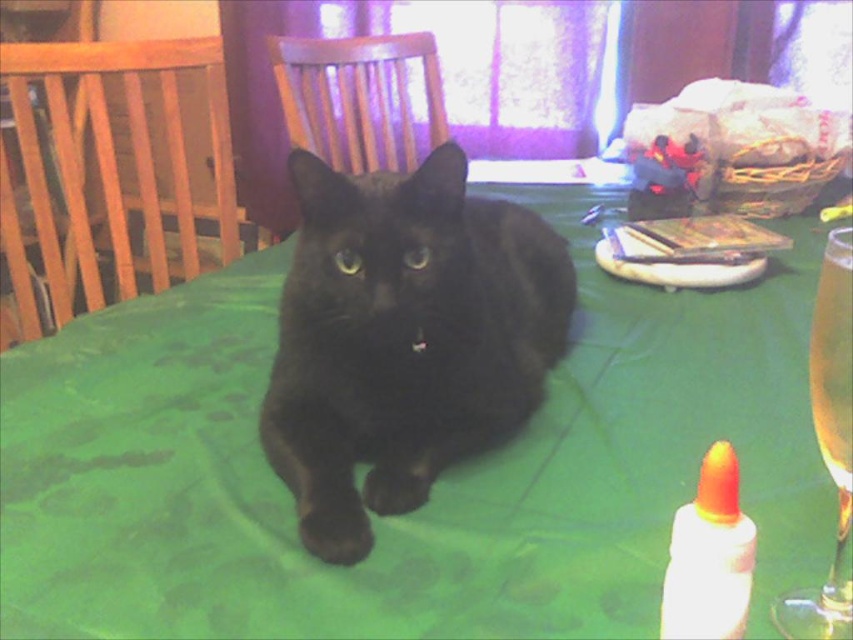
Based on the photo, is white glossy glue bottle at lower right smaller than translucent glass at upper right?

Yes, white glossy glue bottle at lower right is smaller than translucent glass at upper right.

Is white glossy glue bottle at lower right bigger than translucent glass at upper right?

Actually, white glossy glue bottle at lower right might be smaller than translucent glass at upper right.

Between point (674, 544) and point (843, 332), which one is positioned in front?

Point (674, 544) is in front.

Locate an element on the screen. This screenshot has width=853, height=640. white glossy glue bottle at lower right is located at coordinates (709, 556).

Does green fabric table at center have a smaller size compared to translucent glass at upper right?

Incorrect, green fabric table at center is not smaller in size than translucent glass at upper right.

Does point (544, 211) come closer to viewer compared to point (828, 307)?

No, (544, 211) is behind (828, 307).

Does point (138, 454) lie in front of point (839, 305)?

No, it is not.

The height and width of the screenshot is (640, 853). Find the location of `green fabric table at center`. green fabric table at center is located at coordinates 433,484.

From the picture: Is translucent glass wine at right shorter than translucent glass at upper right?

In fact, translucent glass wine at right may be taller than translucent glass at upper right.

At what (x,y) coordinates should I click in order to perform the action: click on translucent glass wine at right. Please return your answer as a coordinate pair (x, y). This screenshot has width=853, height=640. Looking at the image, I should click on (828, 444).

I want to click on translucent glass wine at right, so pyautogui.click(x=828, y=444).